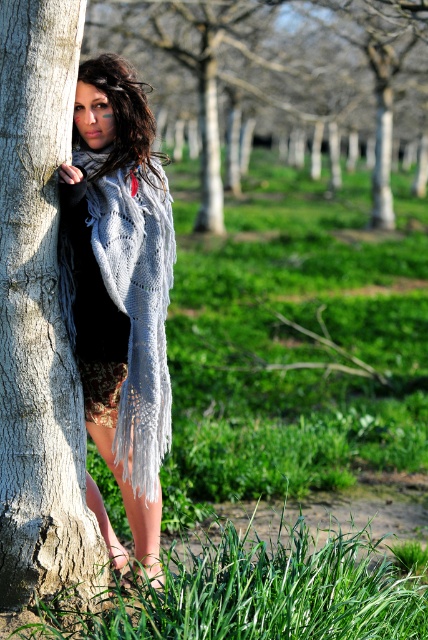
You are an artist trying to sketch this scene. You notice two smooth gray elements on the left side of the image. Which one is taller, the smooth gray tree trunk at left or the smooth gray bark at left?

The smooth gray tree trunk at left is taller than the smooth gray bark at left.

You are a photographer standing at the scene. Your camera is set to capture a photo with a depth of field that can clearly focus on objects within 3 meters. You want to take a photo of the knitted wool shawl at left. Will the shawl be in focus?

The knitted wool shawl at left is 3.41 meters away from the camera, which is beyond the 3 meter depth of field limit. Therefore, the shawl will not be in focus.